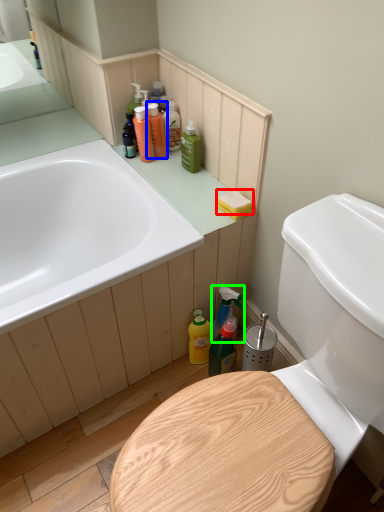
Question: Which object is the closest to the soap (highlighted by a red box)? Choose among these: cleaning product (highlighted by a blue box) or cleaning product (highlighted by a green box).

Choices:
 (A) cleaning product
 (B) cleaning product

Answer: (B)